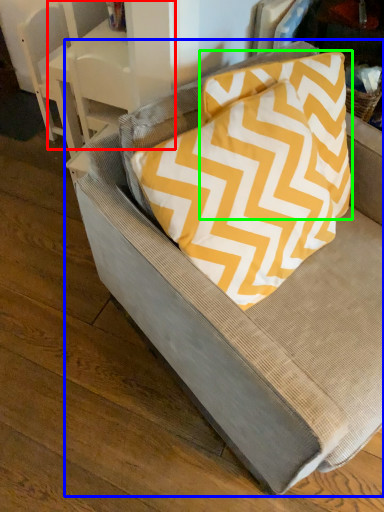
Question: Considering the real-world distances, which object is farthest from table (highlighted by a red box)? chair (highlighted by a blue box) or pillow (highlighted by a green box)?

Choices:
 (A) chair
 (B) pillow

Answer: (A)